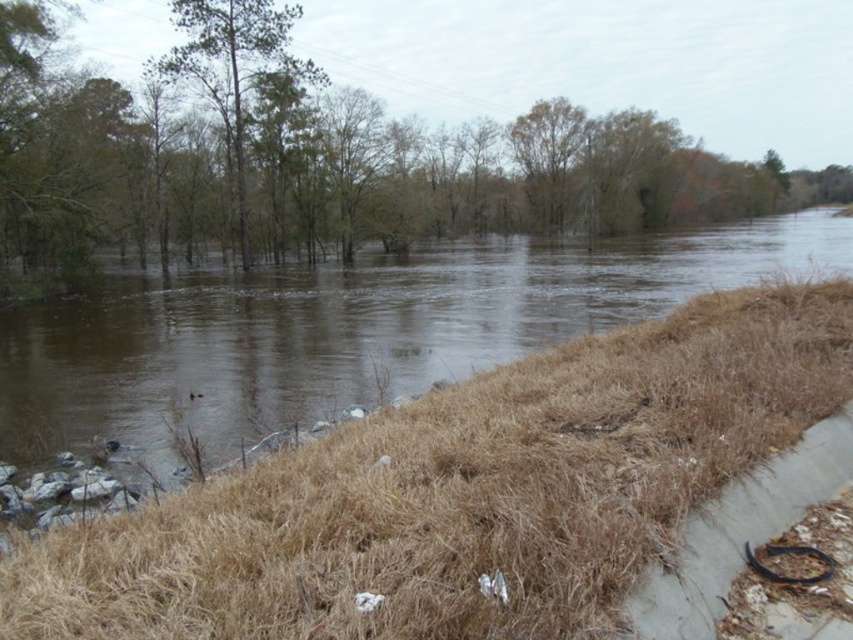
Based on the scene, if you are standing on the concrete embankment in the foreground and want to reach the green leafy tree at upper center, which direction should you move relative to the brown muddy water at center?

You should move to the right of the brown muddy water at center to reach the green leafy tree at upper center since the tree is positioned to the right of the water.

You are a hiker trying to cross the flooded area. You see the brown muddy water at center and the brown leafy tree at upper center. Which object is located to the left of the other?

The brown muddy water at center is positioned on the left side of brown leafy tree at upper center.

You are a flood relief worker assessing the area. You notice the gray concrete curb at lower right and the green leafy trees at upper left. Which object is positioned lower in the image?

The gray concrete curb at lower right is positioned lower in the image than the green leafy trees at upper left.